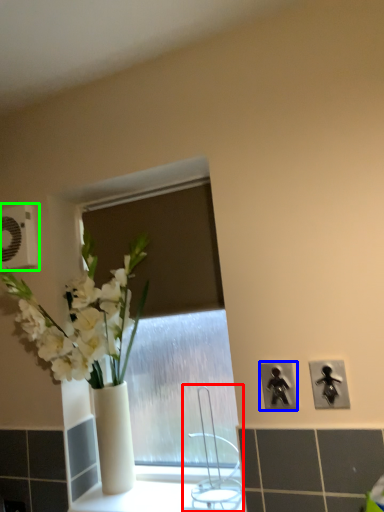
Question: Which object is positioned farthest from faucet (highlighted by a red box)? Select from electric outlet (highlighted by a blue box) and electric outlet (highlighted by a green box).

Choices:
 (A) electric outlet
 (B) electric outlet

Answer: (B)